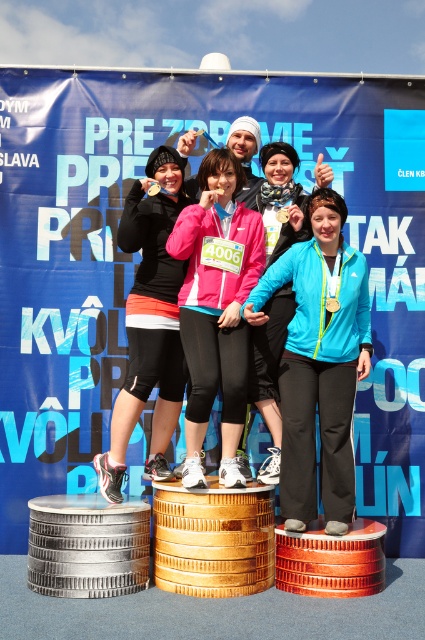
Question: Which point is closer to the camera?

Choices:
 (A) (184, 477)
 (B) (156, 474)

Answer: (A)

Question: Which of the following is the farthest from the observer?

Choices:
 (A) (212, 401)
 (B) (167, 166)
 (C) (271, 186)

Answer: (C)

Question: Is pink fabric jacket at center to the left of matte pink jacket at center from the viewer's perspective?

Choices:
 (A) yes
 (B) no

Answer: (A)

Question: Can you confirm if matte black jacket at center is bigger than matte pink jacket at center?

Choices:
 (A) yes
 (B) no

Answer: (A)

Question: Is matte black jacket at center positioned behind matte pink jacket at center?

Choices:
 (A) no
 (B) yes

Answer: (A)

Question: Which of the following is the farthest from the observer?

Choices:
 (A) pink fabric jacket at center
 (B) matte pink jacket at center

Answer: (B)